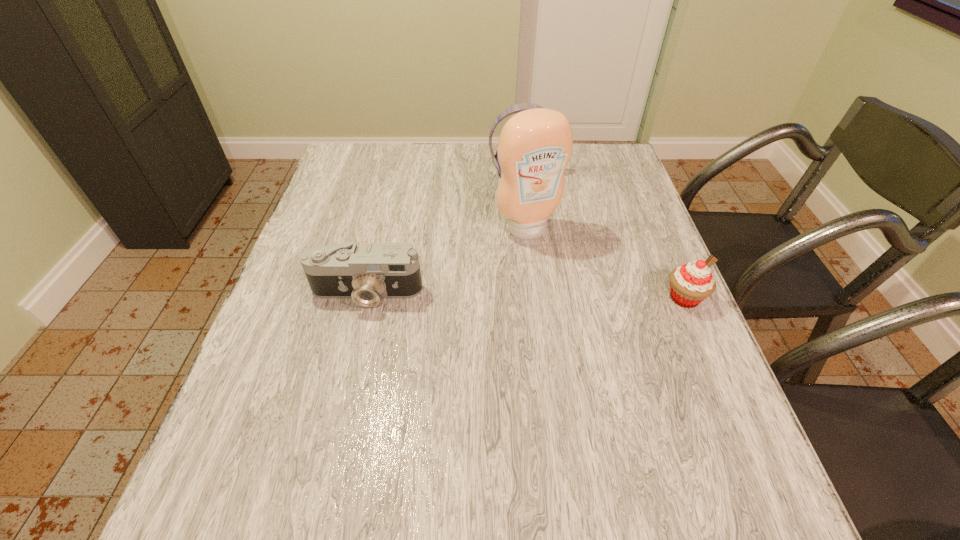
The width and height of the screenshot is (960, 540). I want to click on camera, so click(366, 273).

At what (x,y) coordinates should I click in order to perform the action: click on cupcake. Please return your answer as a coordinate pair (x, y). Looking at the image, I should click on (690, 284).

This screenshot has height=540, width=960. Find the location of `the third shortest object`. the third shortest object is located at coordinates (516, 108).

This screenshot has height=540, width=960. I want to click on headset, so click(516, 108).

Image resolution: width=960 pixels, height=540 pixels. What are the coordinates of `condiment` in the screenshot? It's located at (535, 145).

You are a GUI agent. You are given a task and a screenshot of the screen. Output one action in this format:
    pyautogui.click(x=<x>, y=<y>)
    Task: Click on the third nearest object
    Image resolution: width=960 pixels, height=540 pixels.
    Given the screenshot: What is the action you would take?
    pyautogui.click(x=535, y=145)

The height and width of the screenshot is (540, 960). I want to click on free point located 0.130m on the lens of the camera, so click(349, 363).

Locate an element on the screen. The width and height of the screenshot is (960, 540). free space located 0.320m on the back of the rightmost object is located at coordinates (643, 200).

Where is `free space located on the headband and ear cups of the third shortest object`? The height and width of the screenshot is (540, 960). free space located on the headband and ear cups of the third shortest object is located at coordinates click(529, 192).

Where is `vacant space located 0.140m on the headband and ear cups of the third shortest object`? The image size is (960, 540). vacant space located 0.140m on the headband and ear cups of the third shortest object is located at coordinates (535, 212).